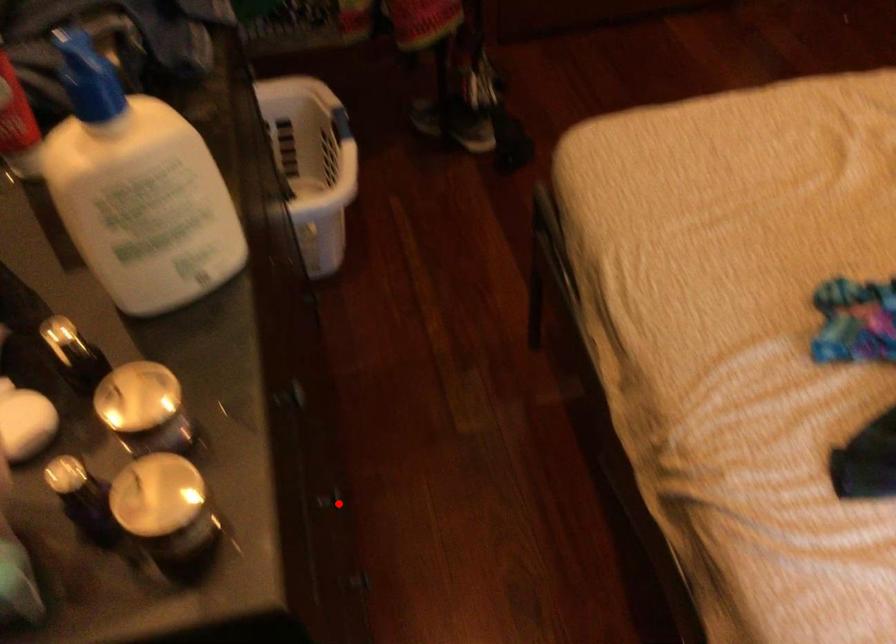
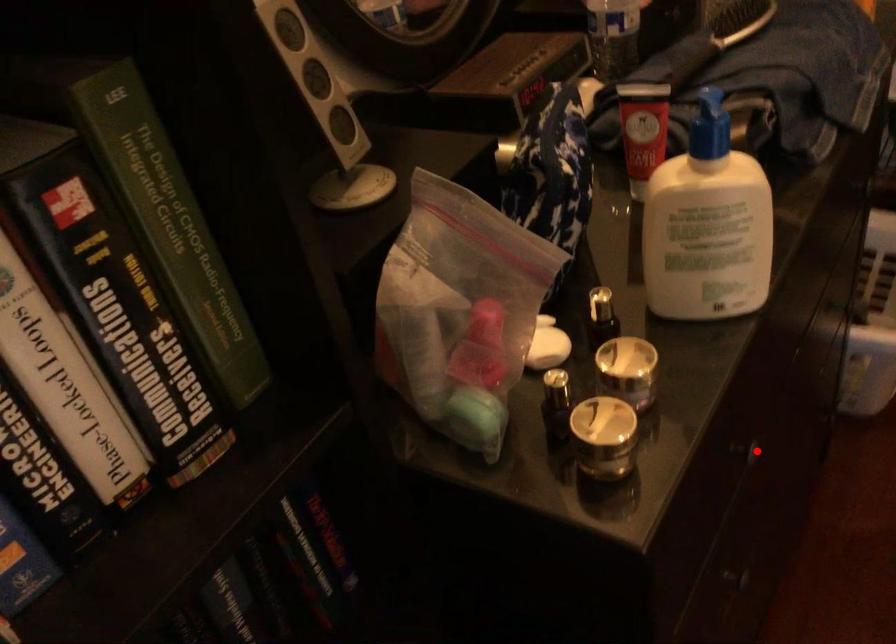
I am providing you with two images of the same scene from different viewpoints. A red point is marked on the first image and another point is marked on the second image. Is the marked point in image1 the same physical position as the marked point in image2?

No